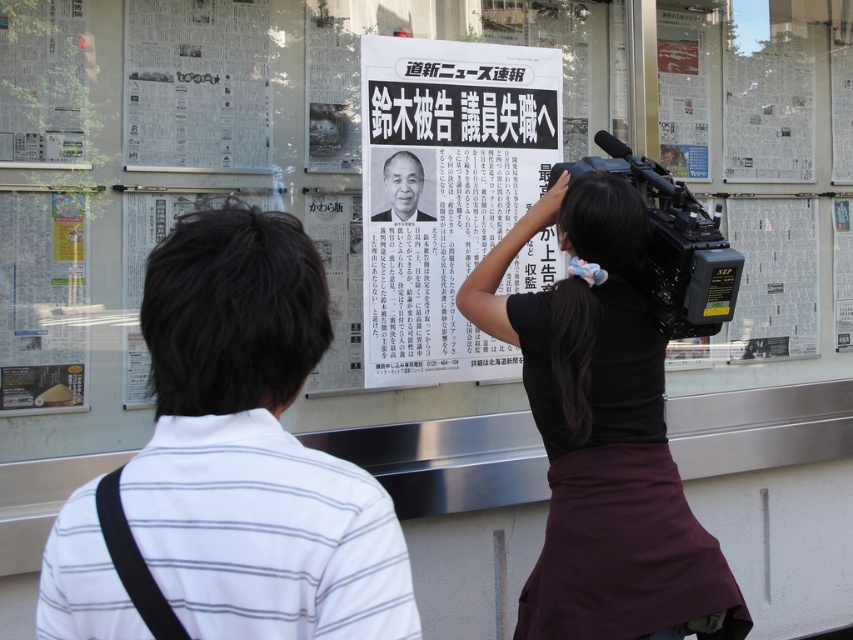
You are a journalist standing in front of the newsroom glass wall. You need to place a black paper at center and a smooth black portrait at center on the wall. Considering their sizes, which object should be placed first to ensure proper alignment?

The black paper at center is taller than the smooth black portrait at center, so you should place the black paper at center first to ensure proper alignment based on its height.

You are a photographer standing in the newsroom scene. You need to take a photo that includes both the white paper poster at upper left and the smooth black portrait at center. What is the minimum distance you must move backward to ensure both objects are in frame?

The minimum distance you must move backward is 26.98 inches to ensure both the white paper poster at upper left and the smooth black portrait at center are in frame.

You are a photographer adjusting your camera settings. You have two points in your viewfinder, point (270, 252) and point (165, 44). Which point will appear larger in your camera frame?

Point (270, 252) is closer to the camera than point (165, 44), so it will appear larger in the camera frame.